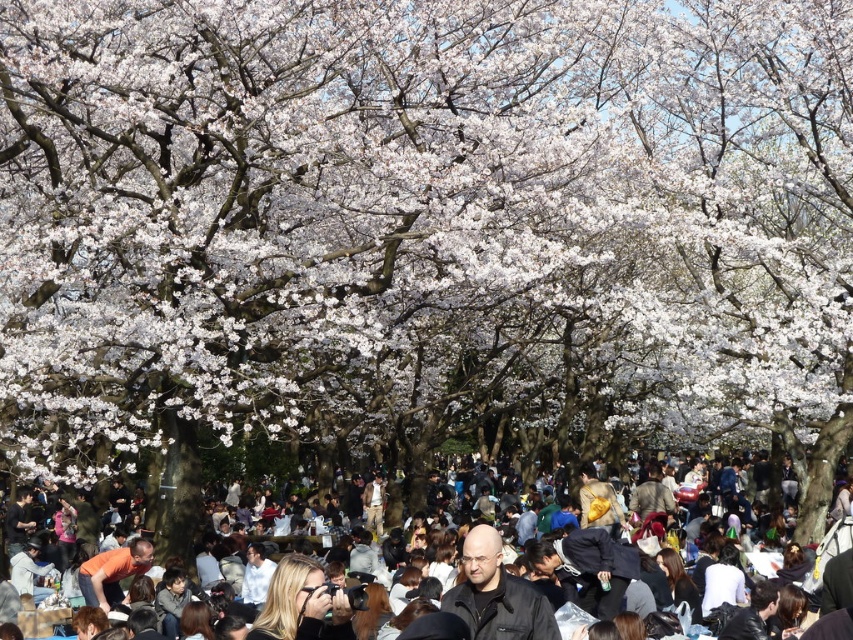
Question: Where is black leather jacket at center located in relation to matte black jacket at lower center in the image?

Choices:
 (A) right
 (B) left

Answer: (B)

Question: Which point appears closest to the camera in this image?

Choices:
 (A) (506, 621)
 (B) (352, 477)

Answer: (A)

Question: Is black leather jacket at center further to camera compared to matte black jacket at lower center?

Choices:
 (A) no
 (B) yes

Answer: (A)

Question: Which point is farther to the camera?

Choices:
 (A) matte black jacket at lower center
 (B) black leather jacket at center

Answer: (A)

Question: Is black leather jacket at center to the left of matte black jacket at lower center from the viewer's perspective?

Choices:
 (A) no
 (B) yes

Answer: (B)